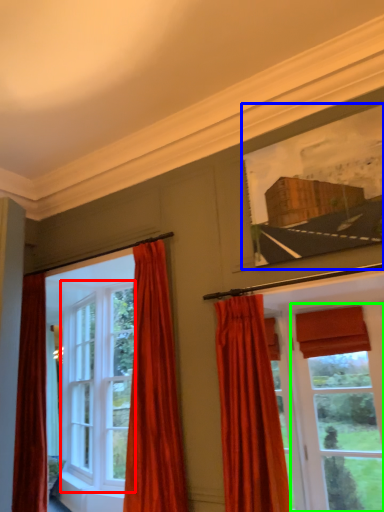
Question: Estimate the real-world distances between objects in this image. Which object is closer to window (highlighted by a red box), picture frame (highlighted by a blue box) or window (highlighted by a green box)?

Choices:
 (A) picture frame
 (B) window

Answer: (B)